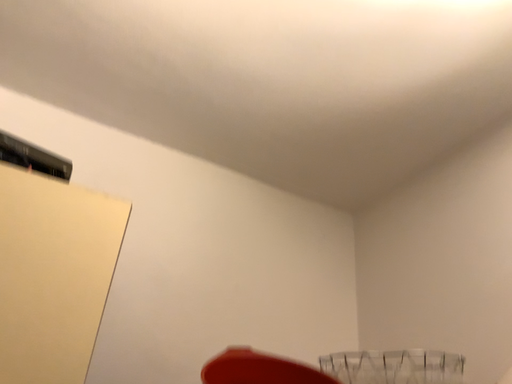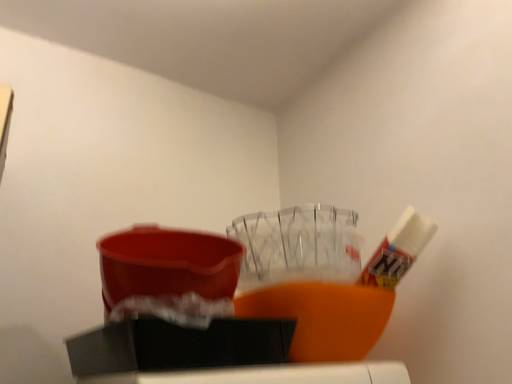
Question: Which way did the camera rotate in the video?

Choices:
 (A) rotated left
 (B) rotated right

Answer: (B)